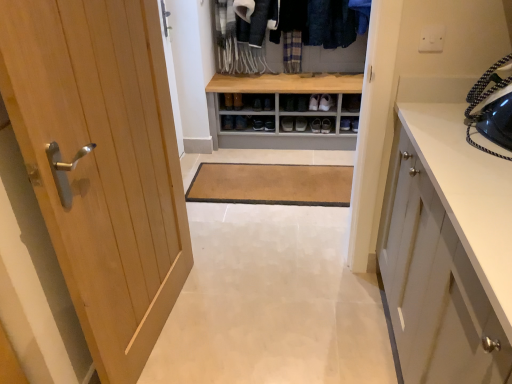
Question: Considering the positions of white plastic electric outlet at upper center and matte black shoe at center, which appears as the 3th footwear when viewed from the right, in the image, is white plastic electric outlet at upper center wider or thinner than matte black shoe at center, which appears as the 3th footwear when viewed from the right,?

Choices:
 (A) thin
 (B) wide

Answer: (A)

Question: Would you say white plastic electric outlet at upper center is inside or outside matte black shoe at center, the 1th footwear viewed from the left?

Choices:
 (A) inside
 (B) outside

Answer: (B)

Question: Which of these objects is positioned farthest from the white plastic electric outlet at upper center?

Choices:
 (A) white leather shoe at center, which ranks as the 1th footwear in right-to-left order
 (B) matte gray shoe at center, which is counted as the 2th footwear, starting from the right
 (C) dark blue woolen sweater at upper center
 (D) matte black shoe at center, marked as the first shoe in a left-to-right arrangement
 (E) light wood door at left

Answer: (D)

Question: Considering the real-world distances, which object is farthest from the wooden dresser at center?

Choices:
 (A) matte black shoe at center, which is the second shoe in top-to-bottom order
 (B) dark blue woolen sweater at upper center
 (C) matte black shoe at center, the 1th footwear viewed from the left
 (D) matte gray shelf at center
 (E) white plastic electric outlet at upper center

Answer: (E)